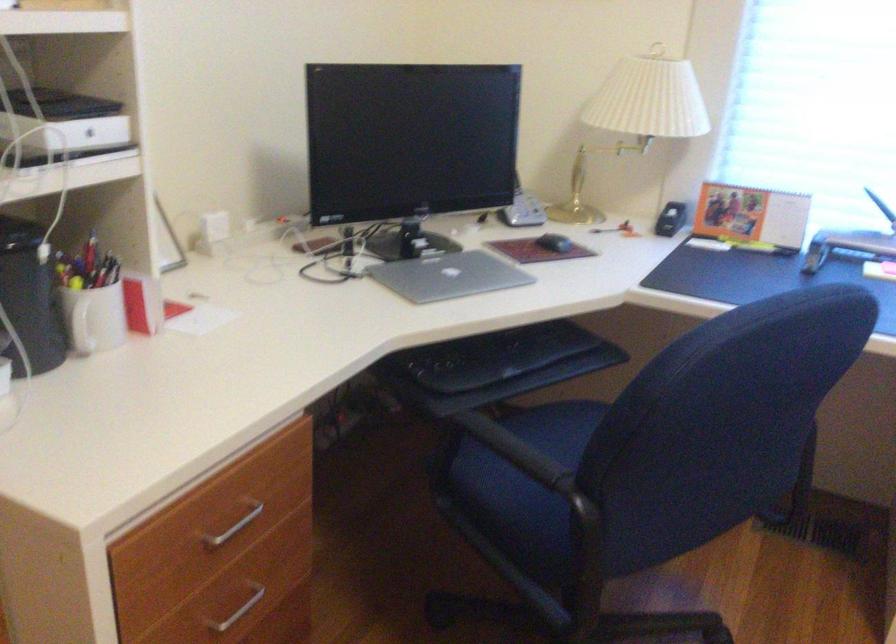
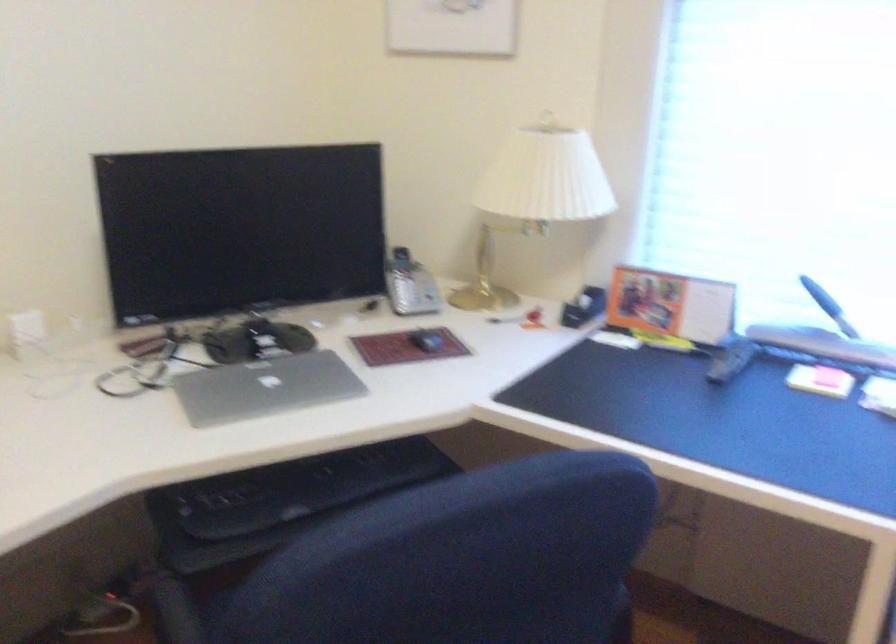
The point at (x=754, y=214) is marked in the first image. Where is the corresponding point in the second image?

(670, 305)